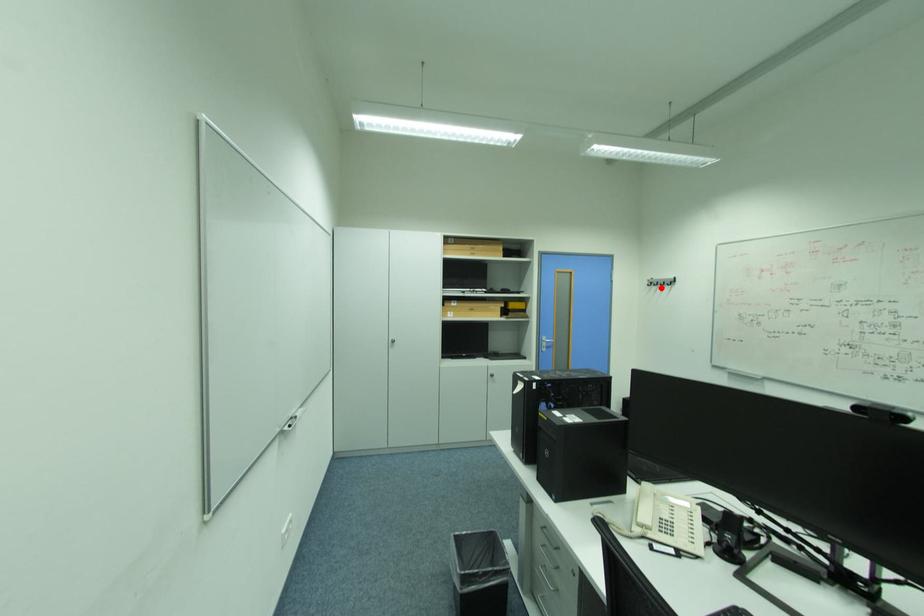
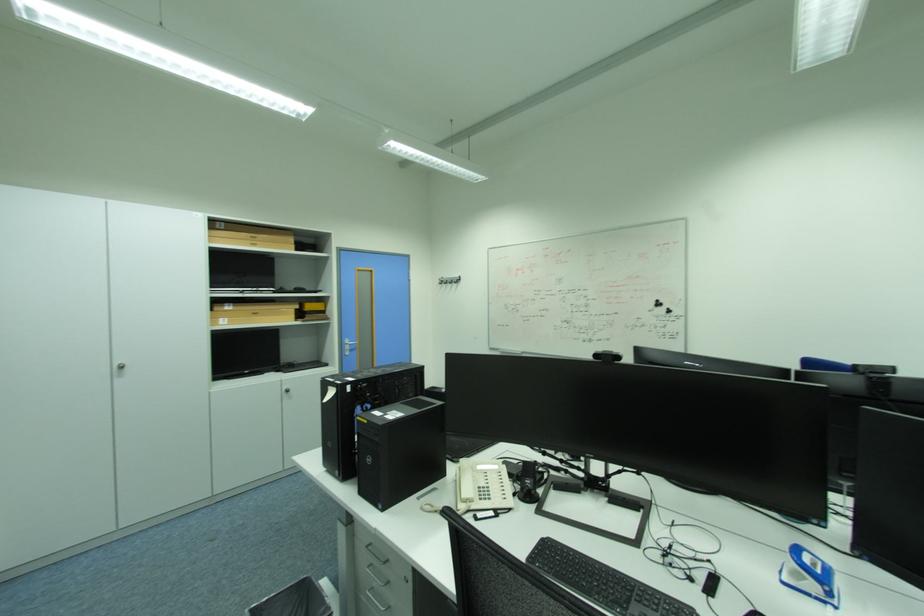
Locate, in the second image, the point that corresponds to the highlighted location in the first image.

(451, 286)